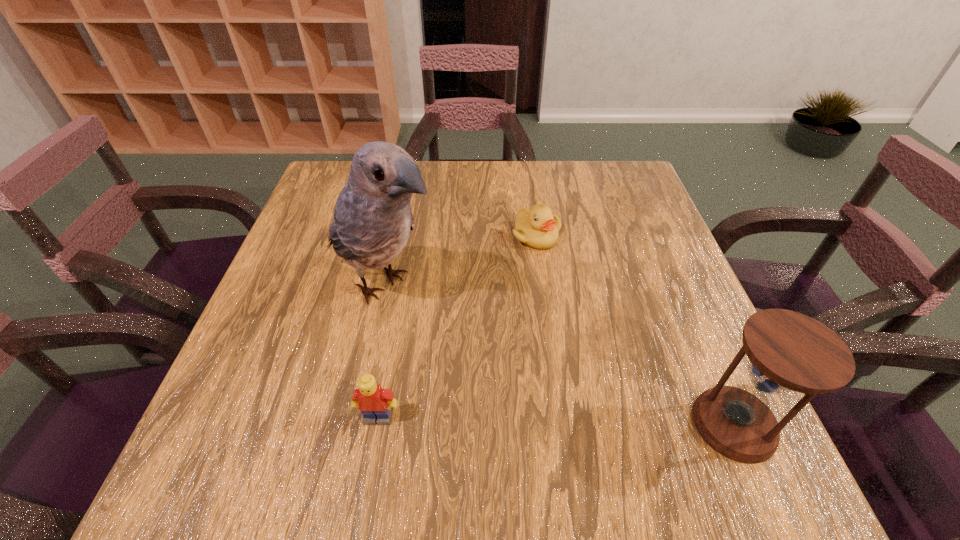
The image size is (960, 540). In the image, there is a desktop. Identify the location of free space at the left edge. (300, 234).

In the image, there is a desktop. Where is `free space at the right edge`? The width and height of the screenshot is (960, 540). free space at the right edge is located at coordinates (679, 286).

Find the location of a particular element. Image resolution: width=960 pixels, height=540 pixels. vacant space at the near left corner of the desktop is located at coordinates (281, 422).

In the image, there is a desktop. In order to click on vacant space at the far right corner in this screenshot , I will do `click(621, 190)`.

I want to click on free space between the shortest object and the Lego, so click(457, 327).

At what (x,y) coordinates should I click in order to perform the action: click on vacant space that is in between the third object from left to right and the hourglass. Please return your answer as a coordinate pair (x, y). The height and width of the screenshot is (540, 960). Looking at the image, I should click on (635, 330).

The height and width of the screenshot is (540, 960). What are the coordinates of `free spot between the Lego and the third nearest object` in the screenshot? It's located at (381, 351).

Identify the location of free space between the second object from right to left and the third tallest object. (457, 327).

Locate an element on the screen. This screenshot has width=960, height=540. vacant area between the duckling and the second farthest object is located at coordinates (460, 260).

Locate an element on the screen. The image size is (960, 540). vacant space in between the Lego and the farthest object is located at coordinates (457, 327).